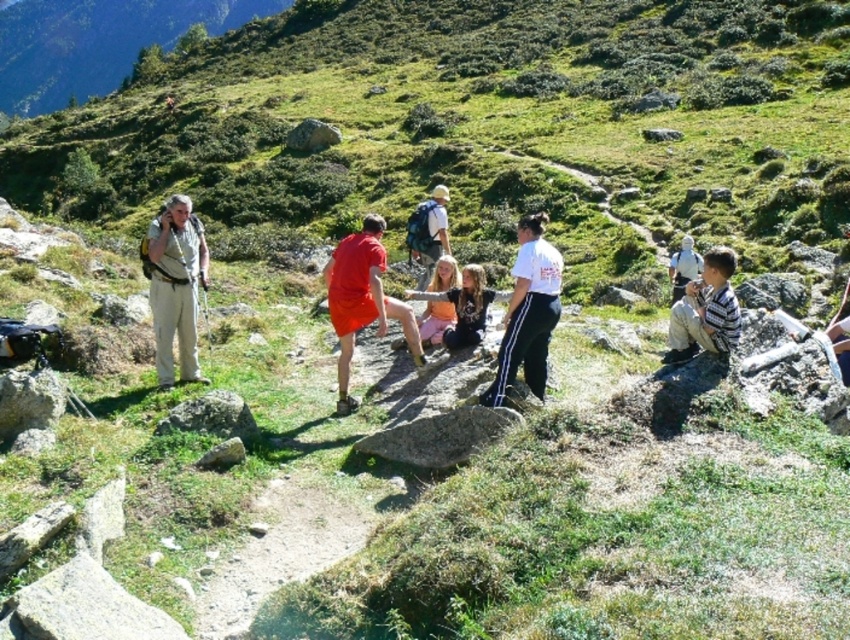
Question: Does white matte pants at center have a lesser width compared to green grassy rock at center?

Choices:
 (A) no
 (B) yes

Answer: (A)

Question: Which point is closer to the camera?

Choices:
 (A) matte pink shirt at center
 (B) white matte pants at center
 (C) green grassy rock at center
 (D) gray rough rock at center

Answer: (D)

Question: Which object appears closest to the camera in this image?

Choices:
 (A) striped shirt at right
 (B) matte pink shirt at center
 (C) gray rough rock at center

Answer: (C)

Question: Is matte pink shirt at center positioned at the back of white cotton shirt at upper right?

Choices:
 (A) yes
 (B) no

Answer: (B)

Question: Can you confirm if green grassy rock at center is wider than matte orange shirt at center?

Choices:
 (A) yes
 (B) no

Answer: (A)

Question: Which point is farther from the camera taking this photo?

Choices:
 (A) (435, 324)
 (B) (547, 259)
 (C) (443, 196)
 (D) (694, 316)

Answer: (C)